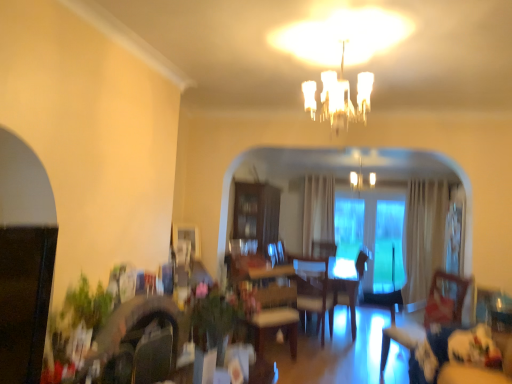
Question: Is white frosted glass chandelier at upper center next to velvet blue couch at lower right and touching it?

Choices:
 (A) yes
 (B) no

Answer: (B)

Question: Is white frosted glass chandelier at upper center at the left side of velvet blue couch at lower right?

Choices:
 (A) yes
 (B) no

Answer: (B)

Question: Is white frosted glass chandelier at upper center outside of velvet blue couch at lower right?

Choices:
 (A) no
 (B) yes

Answer: (B)

Question: Is white frosted glass chandelier at upper center further to the viewer compared to velvet blue couch at lower right?

Choices:
 (A) yes
 (B) no

Answer: (A)

Question: Considering the relative positions of white frosted glass chandelier at upper center and velvet blue couch at lower right in the image provided, is white frosted glass chandelier at upper center to the right of velvet blue couch at lower right from the viewer's perspective?

Choices:
 (A) no
 (B) yes

Answer: (B)

Question: Looking at the image, does clear glass chandelier at upper center seem bigger or smaller compared to wooden swivel chair at lower right?

Choices:
 (A) big
 (B) small

Answer: (B)

Question: From a real-world perspective, is clear glass chandelier at upper center physically located above or below wooden swivel chair at lower right?

Choices:
 (A) above
 (B) below

Answer: (A)

Question: From the image's perspective, is clear glass chandelier at upper center above or below wooden swivel chair at lower right?

Choices:
 (A) above
 (B) below

Answer: (A)

Question: From their relative heights in the image, would you say clear glass chandelier at upper center is taller or shorter than wooden swivel chair at lower right?

Choices:
 (A) short
 (B) tall

Answer: (A)

Question: From the image's perspective, is wooden swivel chair at lower right positioned above or below white frosted glass chandelier at upper center?

Choices:
 (A) above
 (B) below

Answer: (B)

Question: Does point (380, 380) appear closer or farther from the camera than point (357, 183)?

Choices:
 (A) closer
 (B) farther

Answer: (A)

Question: From a real-world perspective, is wooden swivel chair at lower right physically located above or below white frosted glass chandelier at upper center?

Choices:
 (A) below
 (B) above

Answer: (A)

Question: Based on their positions, is wooden swivel chair at lower right located to the left or right of white frosted glass chandelier at upper center?

Choices:
 (A) left
 (B) right

Answer: (B)

Question: Is white frosted glass chandelier at upper center spatially inside transparent glass door at center, or outside of it?

Choices:
 (A) outside
 (B) inside

Answer: (A)

Question: Is white frosted glass chandelier at upper center wider or thinner than transparent glass door at center?

Choices:
 (A) wide
 (B) thin

Answer: (A)